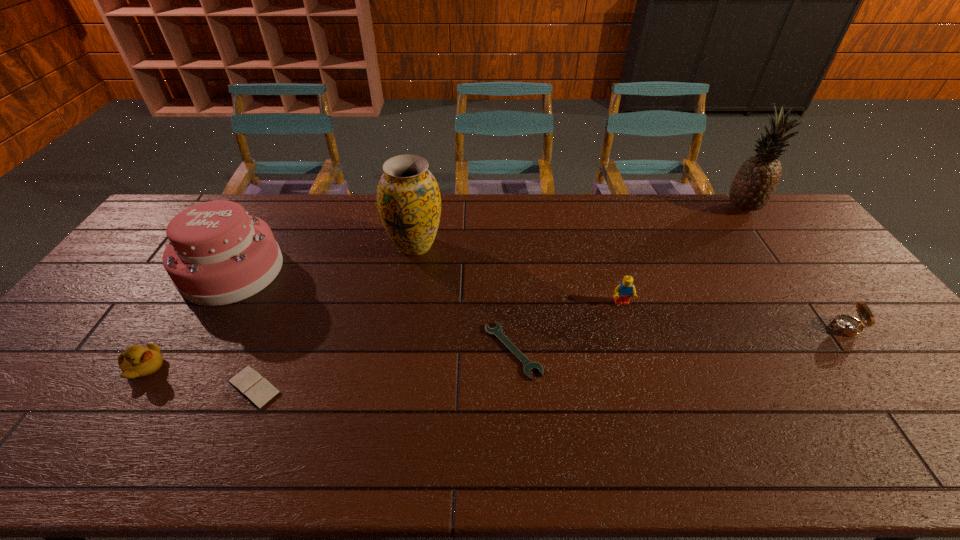
Identify the location of the shortest object. (528, 365).

Locate an element on the screen. Image resolution: width=960 pixels, height=540 pixels. free location located on the left of the tallest object is located at coordinates (688, 208).

Locate an element on the screen. free space located 0.110m on the back of the seventh shortest object is located at coordinates (420, 209).

Find the location of a particular element. This screenshot has height=540, width=960. free location located on the front of the sixth shortest object is located at coordinates (178, 363).

Identify the location of free region located 0.110m on the front-facing side of the Lego. This screenshot has height=540, width=960. (633, 339).

Image resolution: width=960 pixels, height=540 pixels. I want to click on free space located 0.130m with the dial facing the compass, so click(x=781, y=328).

The image size is (960, 540). Identify the location of free point located with the dial facing the compass. (682, 328).

Locate an element on the screen. Image resolution: width=960 pixels, height=540 pixels. blank area located with the dial facing the compass is located at coordinates (807, 328).

The image size is (960, 540). I want to click on free location located 0.200m on the front-facing side of the duckling, so click(243, 367).

Locate an element on the screen. Image resolution: width=960 pixels, height=540 pixels. vacant point located on the right of the diary is located at coordinates (420, 387).